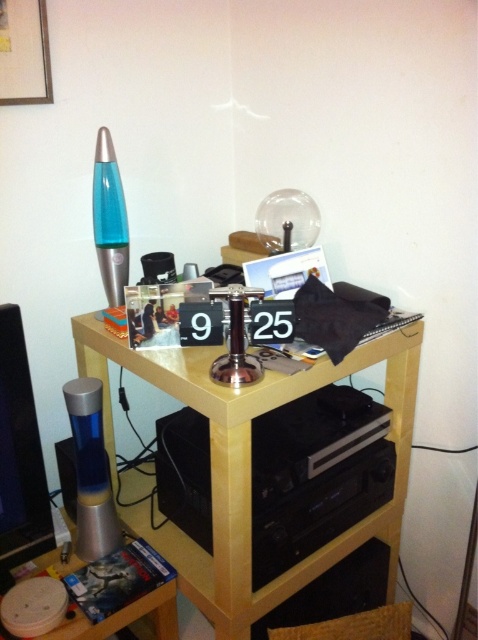
You are organizing the items on the side table and need to stack the matte plastic dvd case at lower left on top of the black plastic stereo at center. Is this possible based on their sizes?

The black plastic stereo at center is taller than the matte plastic dvd case at lower left, so stacking the dvd case on top of the stereo is possible since the stereo provides a stable base.

You are a delivery person trying to place a rectangular package that is 4 inches wide. You need to place it between the light wood table at center and the black plastic stereo at center. Is there enough space between them to fit the package?

The distance between the light wood table at center and the black plastic stereo at center is 4.35 inches, which is slightly more than the 4 inch width of the package. Therefore, the package can fit between them with a small amount of space to spare.

You are trying to place a matte plastic dvd case at lower left on top of the light wood table at center. Will it fit without hanging over the edges?

The light wood table at center is taller than matte plastic dvd case at lower left, so the DVD case will fit on top without hanging over the edges since it is shorter than the table.